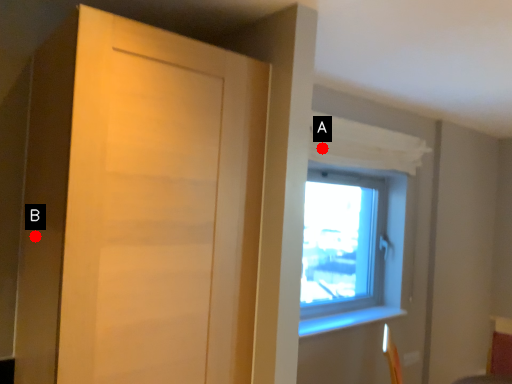
Question: Two points are circled on the image, labeled by A and B beside each circle. Which of the following is the closest to the observer?

Choices:
 (A) A is closer
 (B) B is closer

Answer: (B)